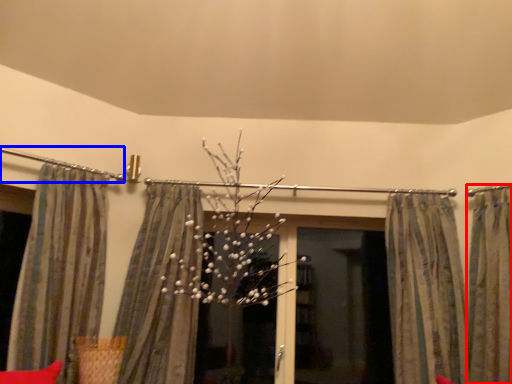
Question: Which of the following is the closest to the observer, curtain (highlighted by a red box) or clothesline (highlighted by a blue box)?

Choices:
 (A) curtain
 (B) clothesline

Answer: (A)